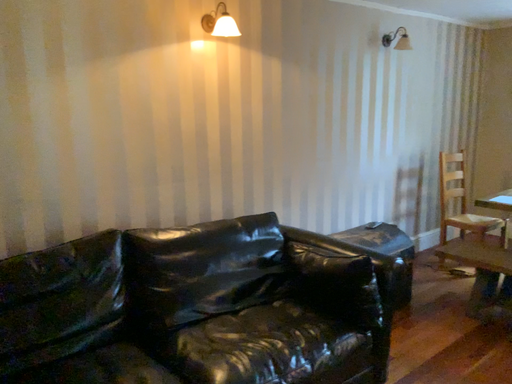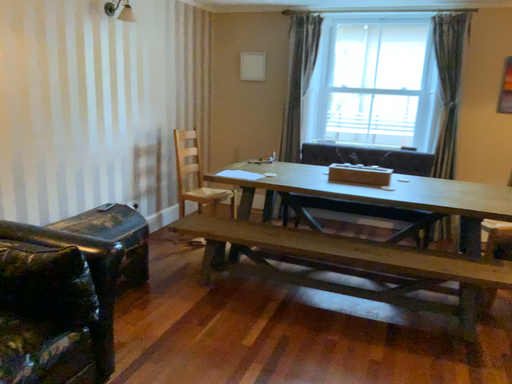
Question: Which way did the camera rotate in the video?

Choices:
 (A) rotated right
 (B) rotated left

Answer: (A)